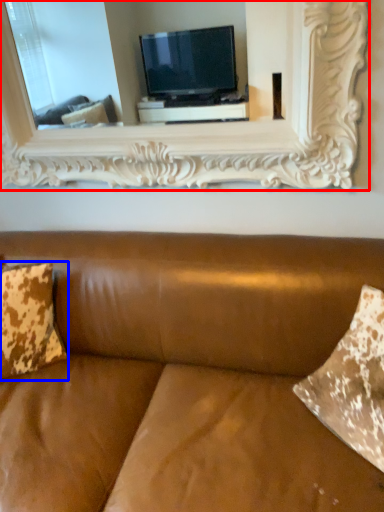
Question: Which object is further to the camera taking this photo, picture frame (highlighted by a red box) or pillow (highlighted by a blue box)?

Choices:
 (A) picture frame
 (B) pillow

Answer: (B)